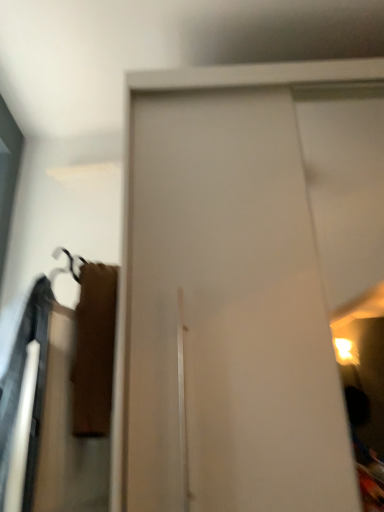
Question: Is white glossy door at center wider or thinner than velvet brown robe at left?

Choices:
 (A) wide
 (B) thin

Answer: (A)

Question: Is white glossy door at center situated inside velvet brown robe at left or outside?

Choices:
 (A) inside
 (B) outside

Answer: (B)

Question: Is white glossy door at center bigger or smaller than velvet brown robe at left?

Choices:
 (A) big
 (B) small

Answer: (A)

Question: Based on their sizes in the image, would you say velvet brown robe at left is bigger or smaller than white glossy door at center?

Choices:
 (A) small
 (B) big

Answer: (A)

Question: In terms of height, does velvet brown robe at left look taller or shorter compared to white glossy door at center?

Choices:
 (A) tall
 (B) short

Answer: (B)

Question: Considering the positions of velvet brown robe at left and white glossy door at center in the image, is velvet brown robe at left wider or thinner than white glossy door at center?

Choices:
 (A) wide
 (B) thin

Answer: (B)

Question: Is velvet brown robe at left to the left or to the right of white glossy door at center in the image?

Choices:
 (A) right
 (B) left

Answer: (B)